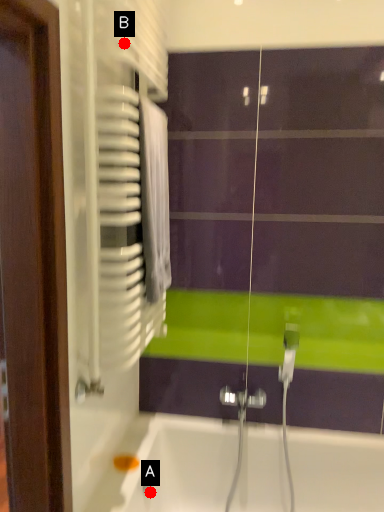
Question: Two points are circled on the image, labeled by A and B beside each circle. Which point is closer to the camera?

Choices:
 (A) A is closer
 (B) B is closer

Answer: (B)